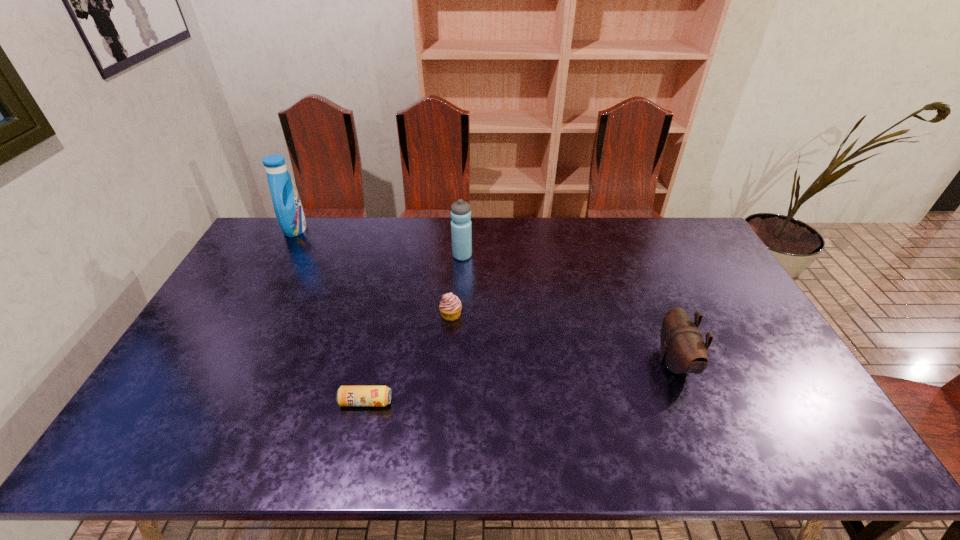
Where is `object that is at the far left corner`? The width and height of the screenshot is (960, 540). object that is at the far left corner is located at coordinates (287, 205).

This screenshot has height=540, width=960. What are the coordinates of `blank area at the far edge` in the screenshot? It's located at (612, 238).

Image resolution: width=960 pixels, height=540 pixels. In order to click on free point at the near edge in this screenshot , I will do `click(732, 428)`.

In the image, there is a desktop. Identify the location of vacant space at the left edge. (167, 420).

At what (x,y) coordinates should I click in order to perform the action: click on free point at the right edge. Please return your answer as a coordinate pair (x, y). Looking at the image, I should click on (726, 362).

The image size is (960, 540). I want to click on vacant point at the near right corner, so click(844, 455).

This screenshot has height=540, width=960. I want to click on vacant space that is in between the leftmost object and the third farthest object, so click(x=373, y=272).

At what (x,y) coordinates should I click in order to perform the action: click on free space between the detergent and the second tallest object. Please return your answer as a coordinate pair (x, y). This screenshot has height=540, width=960. Looking at the image, I should click on (379, 242).

Where is `free space between the beer can and the farthest object`? free space between the beer can and the farthest object is located at coordinates (330, 315).

Identify the location of vacant area that lies between the leftmost object and the shortest object. (330, 315).